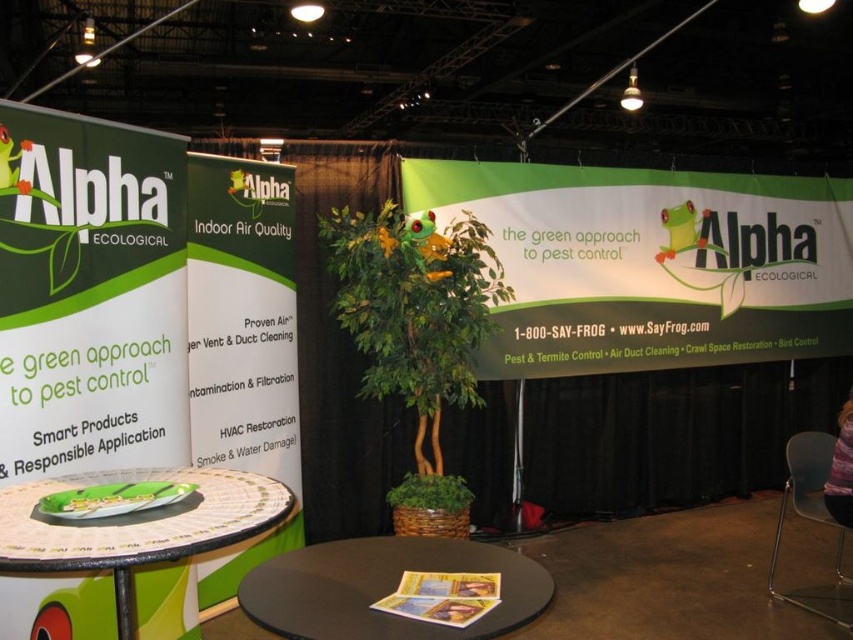
Does green artificial tree at center have a larger size compared to gray plastic chair at lower right?

No.

Is point (439, 468) more distant than point (827, 436)?

That is False.

Find the location of `green artificial tree at center`. green artificial tree at center is located at coordinates (415, 308).

Does gray plastic chair at lower right have a lesser width compared to green leafy plant at center?

No, gray plastic chair at lower right is not thinner than green leafy plant at center.

Between point (821, 488) and point (393, 506), which one is positioned in front?

Positioned in front is point (393, 506).

Is point (828, 456) more distant than point (445, 481)?

Yes, point (828, 456) is behind point (445, 481).

You are a GUI agent. You are given a task and a screenshot of the screen. Output one action in this format:
    pyautogui.click(x=<x>, y=<y>)
    Task: Click on the gray plastic chair at lower right
    This screenshot has height=640, width=853.
    Given the screenshot: What is the action you would take?
    pyautogui.click(x=809, y=515)

Locate an element on the screen. The height and width of the screenshot is (640, 853). green glossy plate at center is located at coordinates (137, 529).

Looking at this image, is green glossy plate at center wider than gray plastic chair at lower right?

Incorrect, green glossy plate at center's width does not surpass gray plastic chair at lower right's.

Between point (24, 548) and point (793, 500), which one is positioned in front?

Point (24, 548) is in front.

The width and height of the screenshot is (853, 640). Identify the location of green glossy plate at center. (137, 529).